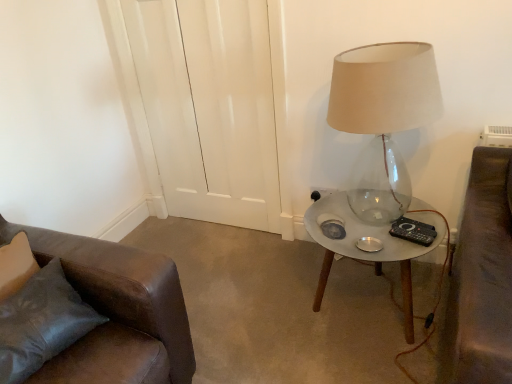
Where is `vacant region under metallic glass table at right (from a real-world perspective)`? The height and width of the screenshot is (384, 512). vacant region under metallic glass table at right (from a real-world perspective) is located at coordinates (361, 296).